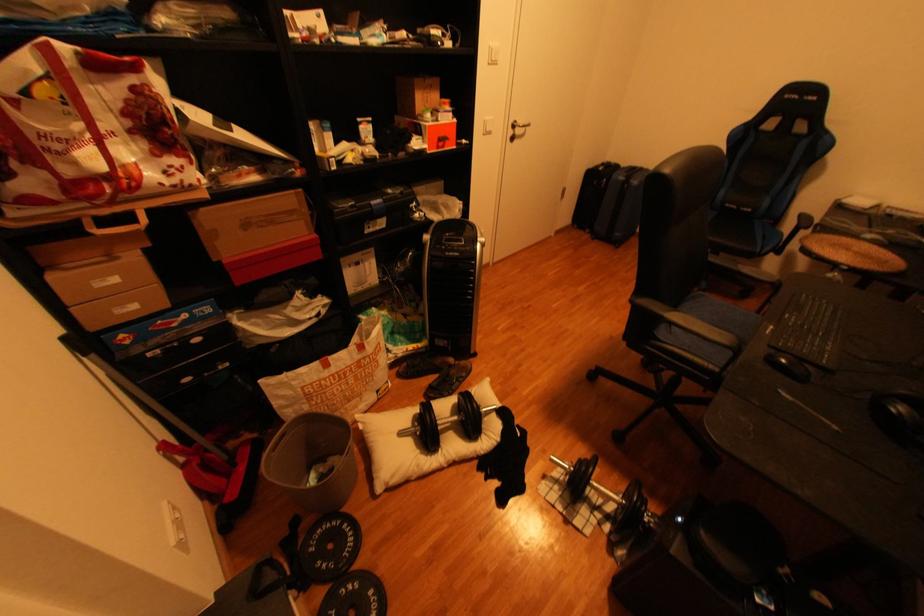
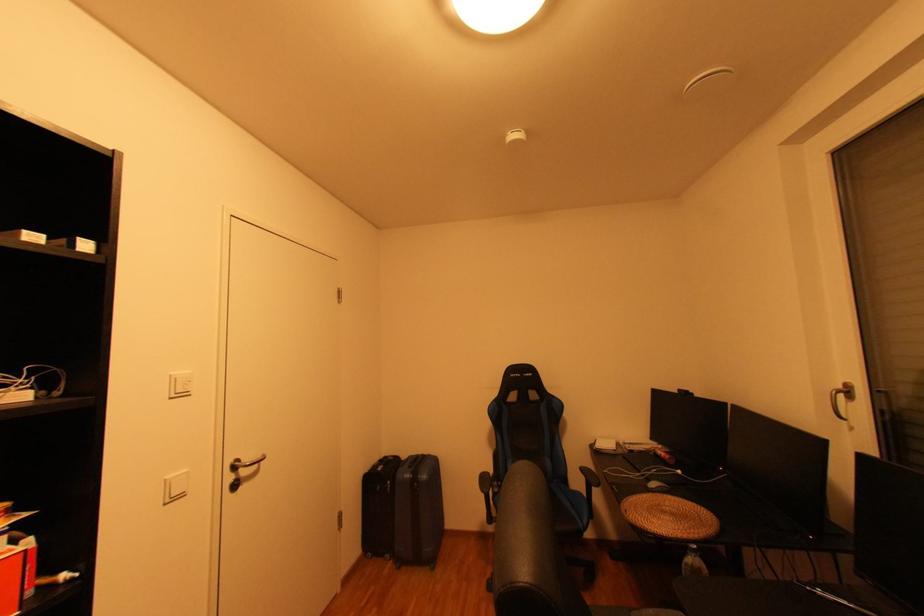
In the second image, find the point that corresponds to pixel 585 225 in the first image.

(380, 554)